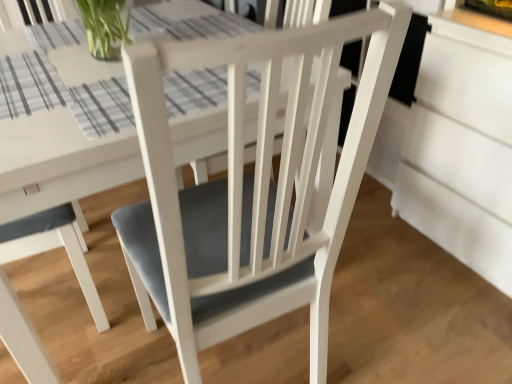
Identify the location of white wood chair at center. The height and width of the screenshot is (384, 512). (250, 189).

This screenshot has width=512, height=384. What do you see at coordinates (250, 189) in the screenshot? I see `white wood chair at center` at bounding box center [250, 189].

Find the location of a particular element. The width and height of the screenshot is (512, 384). white wood chair at center is located at coordinates (250, 189).